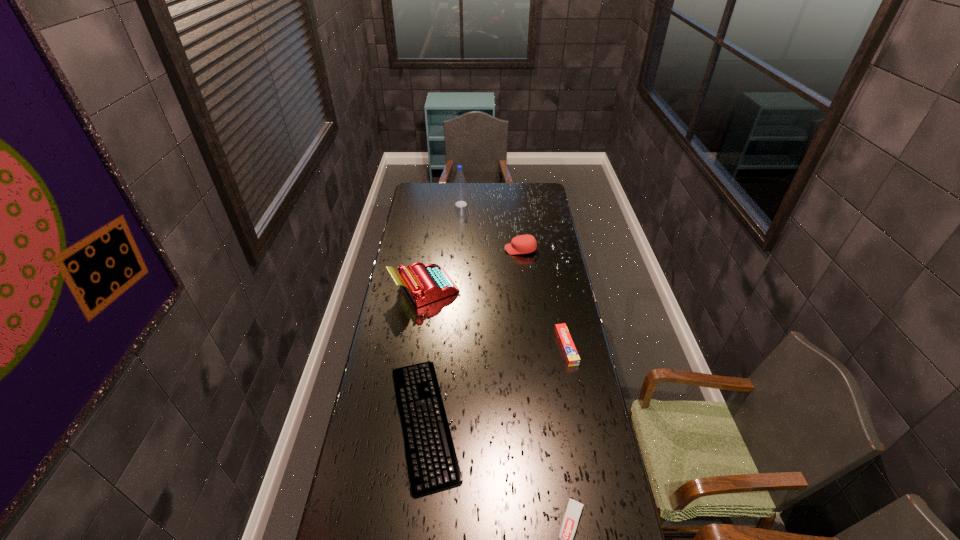
I want to click on vacant space in between the cap and the farthest object, so click(x=491, y=227).

Point out which object is positioned as the second nearest to the computer keyboard. Please provide its 2D coordinates. Your answer should be formatted as a tuple, i.e. [(x, y)], where the tuple contains the x and y coordinates of a point satisfying the conditions above.

[(427, 283)]

Select which object is the third closest to the farthest object. Please provide its 2D coordinates. Your answer should be formatted as a tuple, i.e. [(x, y)], where the tuple contains the x and y coordinates of a point satisfying the conditions above.

[(570, 353)]

At what (x,y) coordinates should I click in order to perform the action: click on vacant area that satisfies the following two spatial constraints: 1. on the typing side of the typewriter; 2. on the right side of the shortest object. Please return your answer as a coordinate pair (x, y). Looking at the image, I should click on (406, 422).

In order to click on free point that satisfies the following two spatial constraints: 1. on the typing side of the typewriter; 2. on the right side of the right toothpaste in this screenshot , I will do `click(417, 347)`.

Identify the location of free location that satisfies the following two spatial constraints: 1. on the back side of the farther toothpaste; 2. on the typing side of the third farthest object. This screenshot has height=540, width=960. (555, 289).